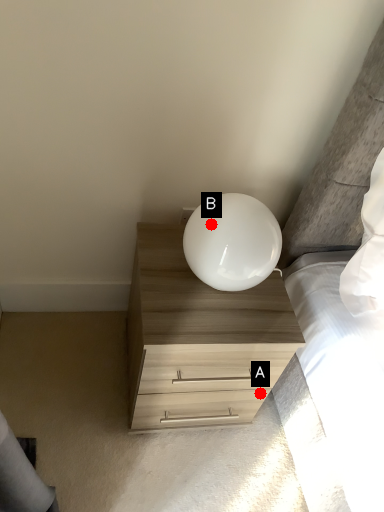
Question: Two points are circled on the image, labeled by A and B beside each circle. Which point is farther to the camera?

Choices:
 (A) A is further
 (B) B is further

Answer: (A)